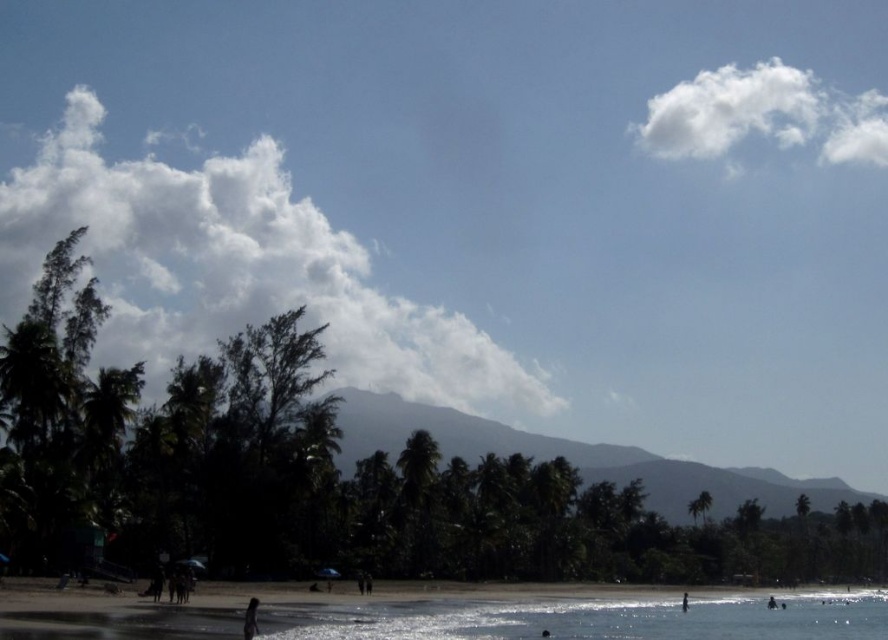
Is white fluffy cloud at upper left bigger than dark skin human at lower center?

Correct, white fluffy cloud at upper left is larger in size than dark skin human at lower center.

Is point (224, 310) positioned in front of point (250, 600)?

No.

Does point (185, 253) come in front of point (247, 616)?

No, it is behind (247, 616).

Locate an element on the screen. white fluffy cloud at upper left is located at coordinates (236, 268).

Describe the element at coordinates (236, 268) in the screenshot. I see `white fluffy cloud at upper left` at that location.

Does white fluffy cloud at upper left appear on the left side of white fluffy cloud at upper right?

Correct, you'll find white fluffy cloud at upper left to the left of white fluffy cloud at upper right.

Where is `white fluffy cloud at upper left`? This screenshot has height=640, width=888. white fluffy cloud at upper left is located at coordinates (236, 268).

Does smooth sand beach at lower center have a lesser height compared to dark skin human at lower right?

Incorrect, smooth sand beach at lower center's height does not fall short of dark skin human at lower right's.

Consider the image. Between smooth sand beach at lower center and dark skin human at lower right, which one has less height?

Standing shorter between the two is dark skin human at lower right.

Where is `smooth sand beach at lower center`? The height and width of the screenshot is (640, 888). smooth sand beach at lower center is located at coordinates (583, 616).

This screenshot has width=888, height=640. In order to click on smooth sand beach at lower center in this screenshot , I will do `click(583, 616)`.